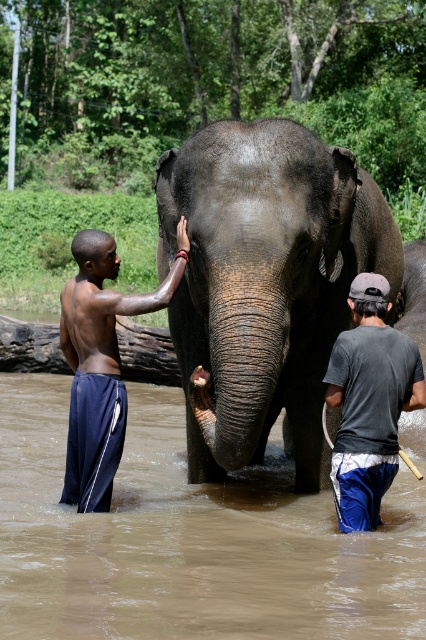
Question: Which of the following is the closest to the observer?

Choices:
 (A) dark gray textured elephant at center
 (B) brown wood log at left

Answer: (A)

Question: Considering the relative positions of dark gray textured elephant at center and dark gray t-shirt at center in the image provided, where is dark gray textured elephant at center located with respect to dark gray t-shirt at center?

Choices:
 (A) above
 (B) below

Answer: (A)

Question: Which point is closer to the camera?

Choices:
 (A) brown muddy water at lower center
 (B) dark gray t-shirt at center

Answer: (B)

Question: Does dark gray textured elephant at center come behind dark gray t-shirt at center?

Choices:
 (A) no
 (B) yes

Answer: (A)

Question: Which of these objects is positioned closest to the dark gray textured elephant at center?

Choices:
 (A) dark gray t-shirt at center
 (B) brown muddy water at lower center
 (C) brown wood log at left
 (D) dark blue shorts at left

Answer: (A)

Question: Can you confirm if brown muddy water at lower center is wider than brown wood log at left?

Choices:
 (A) yes
 (B) no

Answer: (B)